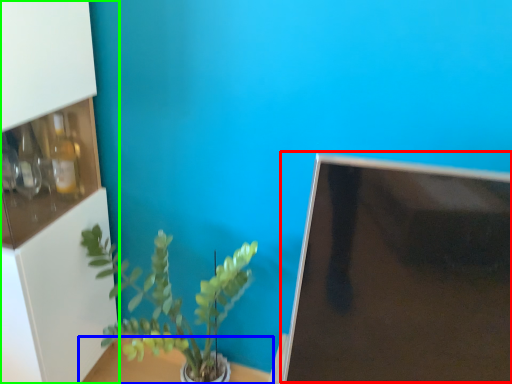
Question: Considering the real-world distances, which object is closest to computer monitor (highlighted by a red box)? table (highlighted by a blue box) or shelf (highlighted by a green box).

Choices:
 (A) table
 (B) shelf

Answer: (B)